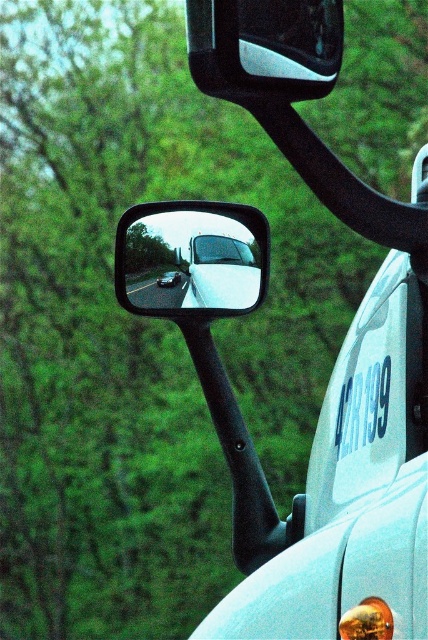
You are a driver looking at the vehicle side mirror. Where is the matte black mirror at upper center located in terms of coordinates?

The matte black mirror at upper center is located at point (264, 48).